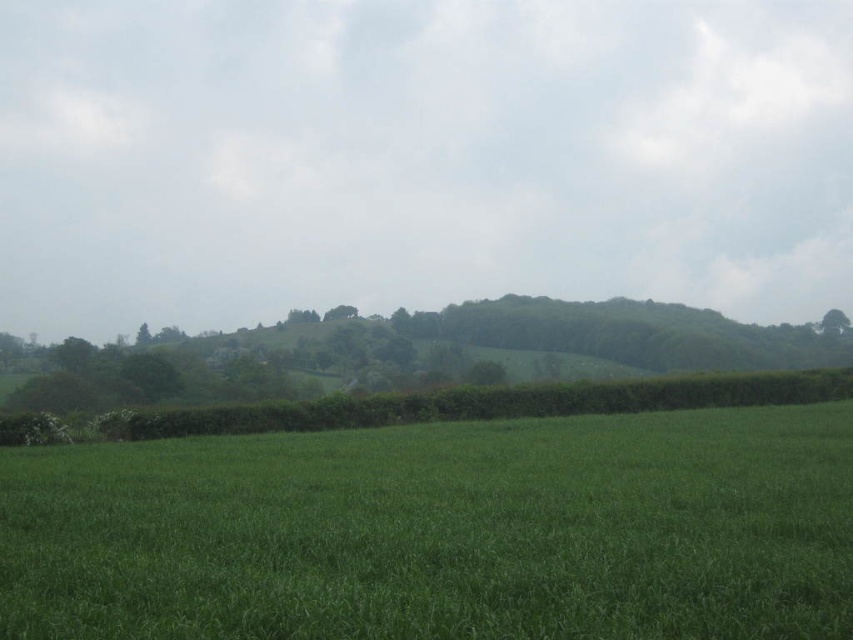
Question: Can you confirm if green grassy hill at center is thinner than green grassy pasture at lower center?

Choices:
 (A) yes
 (B) no

Answer: (B)

Question: Which point is closer to the camera?

Choices:
 (A) (831, 310)
 (B) (822, 406)
 (C) (409, 348)

Answer: (B)

Question: Which object is farther from the camera taking this photo?

Choices:
 (A) green leafy tree at center
 (B) green leafy tree at upper right

Answer: (B)

Question: Is green grassy pasture at lower center in front of green leafy tree at upper right?

Choices:
 (A) yes
 (B) no

Answer: (A)

Question: Among these objects, which one is farthest from the camera?

Choices:
 (A) green grassy pasture at lower center
 (B) green leafy tree at upper right
 (C) green leafy tree at center

Answer: (B)

Question: Considering the relative positions of green grassy hill at center and green grassy pasture at lower center in the image provided, where is green grassy hill at center located with respect to green grassy pasture at lower center?

Choices:
 (A) left
 (B) right

Answer: (A)